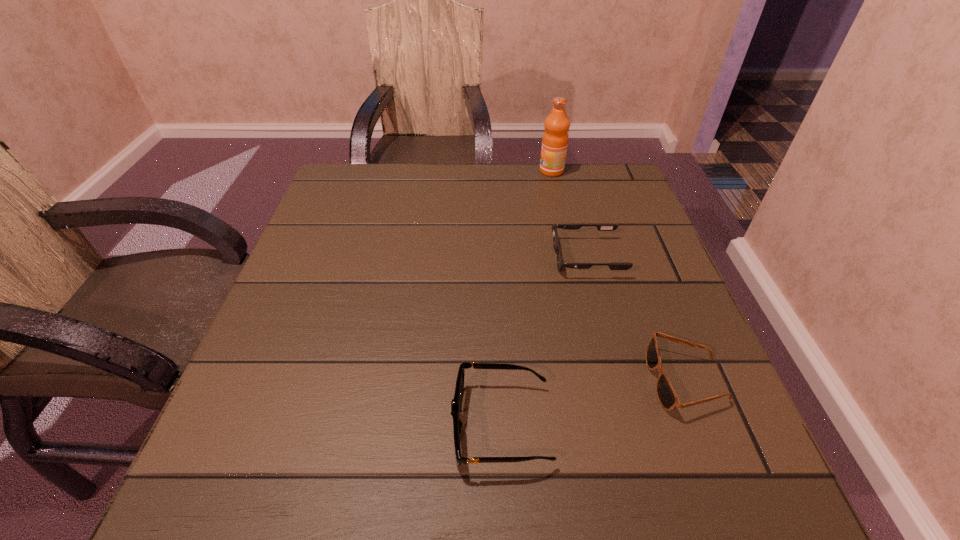
Image resolution: width=960 pixels, height=540 pixels. Identify the location of fruit juice. (555, 138).

The height and width of the screenshot is (540, 960). Identify the location of the tallest object. (555, 138).

Identify the location of the third shortest object. (456, 402).

The height and width of the screenshot is (540, 960). Find the location of `the leftmost object`. the leftmost object is located at coordinates (456, 402).

The height and width of the screenshot is (540, 960). What are the coordinates of `the farthest sunglasses` in the screenshot? It's located at (601, 227).

This screenshot has height=540, width=960. I want to click on vacant point located on the label side of the farthest object, so click(x=517, y=171).

This screenshot has width=960, height=540. I want to click on vacant region located 0.340m on the label side of the farthest object, so click(x=418, y=171).

This screenshot has height=540, width=960. I want to click on vacant point located on the label side of the farthest object, so click(x=521, y=171).

Identify the location of free location located 0.050m on the front-facing side of the leftmost object. The width and height of the screenshot is (960, 540). (420, 426).

Identify the location of vacant space situated on the front-facing side of the leftmost object. This screenshot has height=540, width=960. (292, 426).